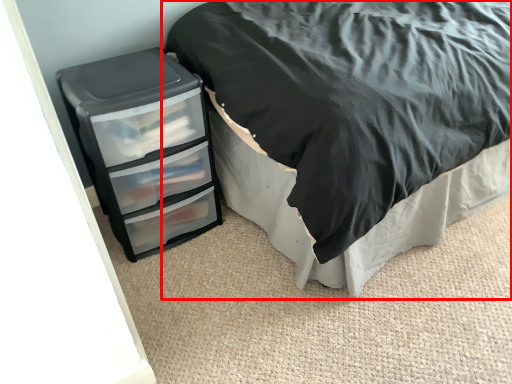
Question: From the image's perspective, where is bed (annotated by the red box) located in relation to chest of drawers in the image?

Choices:
 (A) below
 (B) above

Answer: (B)